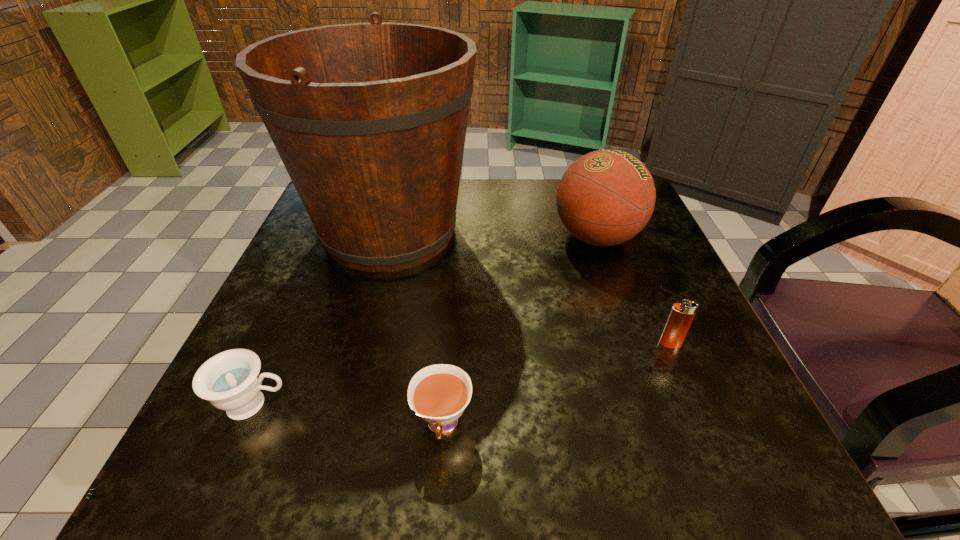
The width and height of the screenshot is (960, 540). In order to click on vacant space that is in between the bucket and the left teacup in this screenshot , I will do `click(322, 318)`.

You are a GUI agent. You are given a task and a screenshot of the screen. Output one action in this format:
    pyautogui.click(x=<x>, y=<y>)
    Task: Click on the vacant space that is in between the right teacup and the fourth shortest object
    The width and height of the screenshot is (960, 540).
    Given the screenshot: What is the action you would take?
    pyautogui.click(x=519, y=330)

The image size is (960, 540). Identify the location of free space that is in between the second tallest object and the right teacup. (519, 330).

This screenshot has height=540, width=960. What are the coordinates of `the third closest object relative to the left teacup` in the screenshot? It's located at (606, 197).

Select which object is the closest to the left teacup. Please provide its 2D coordinates. Your answer should be formatted as a tuple, i.e. [(x, y)], where the tuple contains the x and y coordinates of a point satisfying the conditions above.

[(439, 393)]

Find the location of `free spot that satisfies the following two spatial constraints: 1. on the front side of the basketball; 2. on the side of the left teacup with the handle`. free spot that satisfies the following two spatial constraints: 1. on the front side of the basketball; 2. on the side of the left teacup with the handle is located at coordinates (654, 405).

Locate an element on the screen. free location that satisfies the following two spatial constraints: 1. on the front side of the fourth shortest object; 2. on the side of the left teacup with the handle is located at coordinates (654, 405).